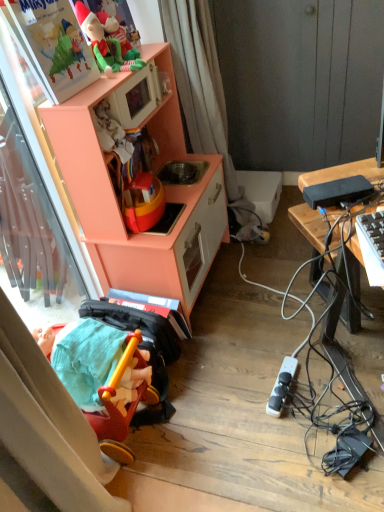
In order to click on vacant area that lies between black plastic desk at right and black plastic power strip at lower right, acting as the 1th appliance starting from the back in this screenshot , I will do `click(307, 354)`.